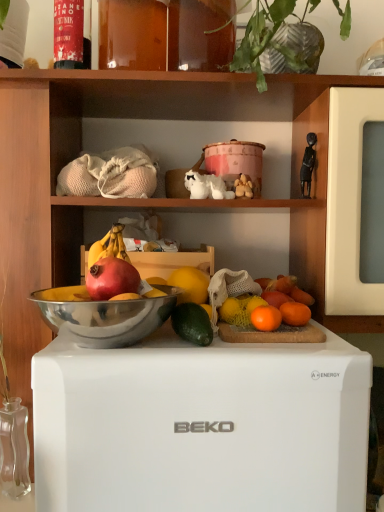
Identify the location of free space in front of green matte avocado at center. (189, 357).